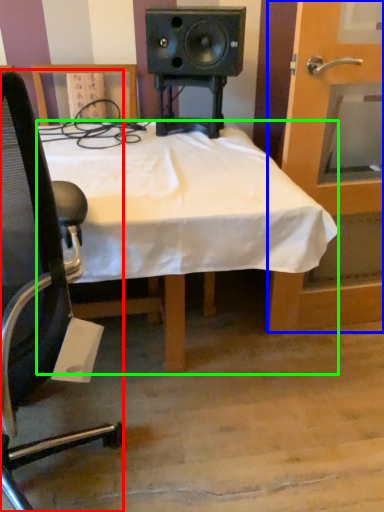
Question: Which object is positioned farthest from chair (highlighted by a red box)? Select from door (highlighted by a blue box) and desk (highlighted by a green box).

Choices:
 (A) door
 (B) desk

Answer: (A)